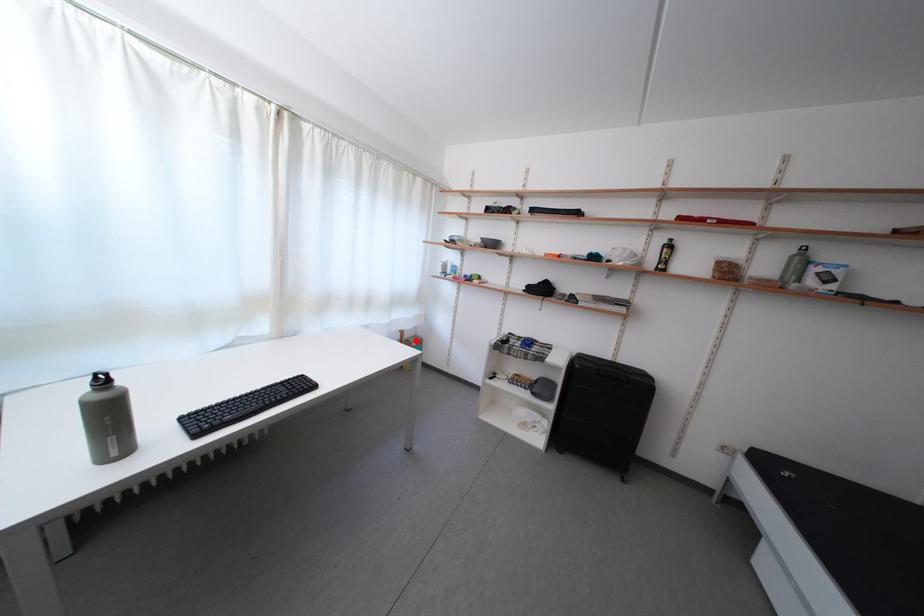
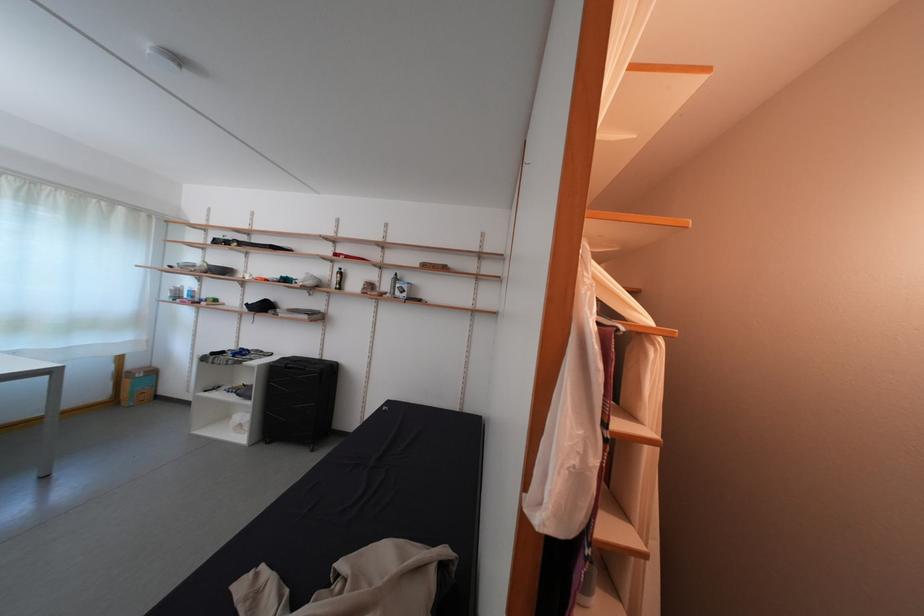
Locate, in the second image, the point that corresponds to the highlighted location in the first image.

(140, 371)